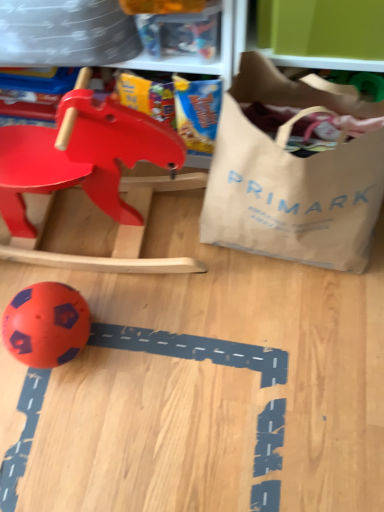
I want to click on vacant area that is in front of brown paper bag at right, so click(287, 346).